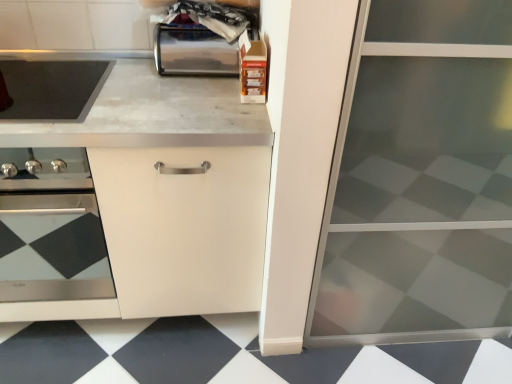
What do you see at coordinates (163, 134) in the screenshot? I see `white marble countertop at center` at bounding box center [163, 134].

Find the location of `white marble countertop at center`. white marble countertop at center is located at coordinates (163, 134).

Measure the distance between point (39, 287) and camera.

The distance of point (39, 287) from camera is 5.29 feet.

The width and height of the screenshot is (512, 384). What do you see at coordinates (193, 51) in the screenshot?
I see `shiny metallic toaster at upper center` at bounding box center [193, 51].

Image resolution: width=512 pixels, height=384 pixels. I want to click on shiny metallic toaster at upper center, so click(193, 51).

The image size is (512, 384). I want to click on smooth black cooktop at upper left, so click(52, 89).

I want to click on transparent glass screen door at right, so click(x=420, y=180).

The image size is (512, 384). I want to click on white marble countertop at center, so click(x=163, y=134).

Which is nearer, (3, 118) or (86, 373)?

Point (3, 118) is closer to the camera than point (86, 373).

Can you confirm if smooth black cooktop at upper left is bigger than black glossy tile at lower center?

Actually, smooth black cooktop at upper left might be smaller than black glossy tile at lower center.

Based on the photo, measure the distance between smooth black cooktop at upper left and black glossy tile at lower center.

smooth black cooktop at upper left is 37.20 inches away from black glossy tile at lower center.

From the image's perspective, is smooth black cooktop at upper left above or below black glossy tile at lower center?

Clearly, from the image's perspective, smooth black cooktop at upper left is above black glossy tile at lower center.

Which is more to the right, smooth black cooktop at upper left or white marble countertop at center?

Positioned to the right is white marble countertop at center.

Identify the location of countertop below the smooth black cooktop at upper left (from the image's perspective). (163, 134).

Can you tell me how much smooth black cooktop at upper left and white marble countertop at center differ in facing direction?

The angular difference between smooth black cooktop at upper left and white marble countertop at center is 0.293 degrees.

Which of these two, smooth black cooktop at upper left or white marble countertop at center, is bigger?

white marble countertop at center.

Is matte black oven at left oriented away from smooth black cooktop at upper left?

No.

Looking at their sizes, would you say matte black oven at left is wider or thinner than smooth black cooktop at upper left?

Clearly, matte black oven at left has more width compared to smooth black cooktop at upper left.

Based on their positions, is matte black oven at left located to the left or right of smooth black cooktop at upper left?

Based on their positions, matte black oven at left is located to the left of smooth black cooktop at upper left.

Considering the relative sizes of matte black oven at left and smooth black cooktop at upper left in the image provided, is matte black oven at left shorter than smooth black cooktop at upper left?

In fact, matte black oven at left may be taller than smooth black cooktop at upper left.

Is transparent glass screen door at right wider than matte black oven at left?

Yes.

Is transparent glass screen door at right touching matte black oven at left?

No.

Which is more distant, (10, 314) or (51, 90)?

The point (51, 90) is farther.

From a real-world perspective, is white marble countertop at center physically below smooth black cooktop at upper left?

Yes, from a real-world perspective, white marble countertop at center is under smooth black cooktop at upper left.

This screenshot has width=512, height=384. I want to click on countertop located below the smooth black cooktop at upper left (from the image's perspective), so click(163, 134).

Would you say black glossy tile at lower center contains matte black oven at left?

No.

Considering the relative positions of black glossy tile at lower center and matte black oven at left in the image provided, is black glossy tile at lower center to the left of matte black oven at left from the viewer's perspective?

No, black glossy tile at lower center is not to the left of matte black oven at left.

From the image's perspective, is black glossy tile at lower center located above or below matte black oven at left?

Based on their image positions, black glossy tile at lower center is located beneath matte black oven at left.

From a real-world perspective, who is located higher, black glossy tile at lower center or matte black oven at left?

matte black oven at left is physically above.

Relative to matte black oven at left, is white marble countertop at center in front or behind?

white marble countertop at center is positioned closer to the viewer than matte black oven at left.

Which object is wider, white marble countertop at center or matte black oven at left?

With larger width is white marble countertop at center.

Based on the photo, considering the positions of objects white marble countertop at center and matte black oven at left in the image provided, who is more to the right, white marble countertop at center or matte black oven at left?

white marble countertop at center is more to the right.

From a real-world perspective, is white marble countertop at center physically above matte black oven at left?

No.

You are a GUI agent. You are given a task and a screenshot of the screen. Output one action in this format:
    pyautogui.click(x=<x>, y=<y>)
    Task: Click on the tile that appears below the smooth black cooktop at upper left (from a real-world perspective)
    The height and width of the screenshot is (384, 512).
    Given the screenshot: What is the action you would take?
    pyautogui.click(x=227, y=355)

Image resolution: width=512 pixels, height=384 pixels. In the image, there is a smooth black cooktop at upper left. In order to click on countertop below it (from the image's perspective) in this screenshot , I will do coord(163,134).

Considering their positions, is black glossy tile at lower center positioned closer to transparent glass screen door at right than smooth black cooktop at upper left?

Among the two, black glossy tile at lower center is located nearer to transparent glass screen door at right.

Looking at the image, which one is located closer to matte black oven at left, shiny metallic toaster at upper center or white marble countertop at center?

white marble countertop at center.

Considering their positions, is black glossy tile at lower center positioned further to shiny metallic toaster at upper center than smooth black cooktop at upper left?

black glossy tile at lower center is positioned further to the anchor shiny metallic toaster at upper center.

Looking at this image, looking at the image, which one is located further to matte black oven at left, shiny metallic toaster at upper center or black glossy tile at lower center?

Among the two, shiny metallic toaster at upper center is located further to matte black oven at left.

Looking at the image, which one is located further to white marble countertop at center, smooth black cooktop at upper left or shiny metallic toaster at upper center?

Based on the image, shiny metallic toaster at upper center appears to be further to white marble countertop at center.

Estimate the real-world distances between objects in this image. Which object is further from matte black oven at left, black glossy tile at lower center or transparent glass screen door at right?

The object further to matte black oven at left is transparent glass screen door at right.

Looking at the image, which one is located further to smooth black cooktop at upper left, transparent glass screen door at right or white marble countertop at center?

Among the two, transparent glass screen door at right is located further to smooth black cooktop at upper left.

Looking at the image, which one is located further to transparent glass screen door at right, white marble countertop at center or smooth black cooktop at upper left?

Based on the image, smooth black cooktop at upper left appears to be further to transparent glass screen door at right.

Locate an element on the screen. countertop between shiny metallic toaster at upper center and black glossy tile at lower center in the up-down direction is located at coordinates (163, 134).

At what (x,y) coordinates should I click in order to perform the action: click on tile between matte black oven at left and transparent glass screen door at right. Please return your answer as a coordinate pair (x, y). The height and width of the screenshot is (384, 512). Looking at the image, I should click on (227, 355).

In order to click on toaster situated between matte black oven at left and transparent glass screen door at right from left to right in this screenshot , I will do `click(193, 51)`.

Find the location of a particular element. kitchen appliance between shiny metallic toaster at upper center and white marble countertop at center vertically is located at coordinates (52, 89).